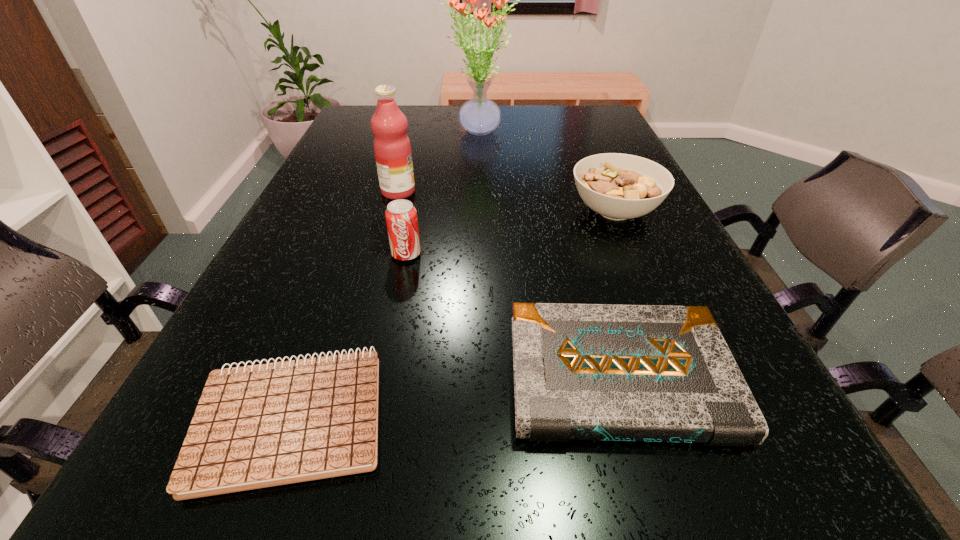
This screenshot has height=540, width=960. Find the location of `vacant area that satisfies the following two spatial constraints: 1. on the logo side of the third nearest object; 2. on the right side of the right notebook`. vacant area that satisfies the following two spatial constraints: 1. on the logo side of the third nearest object; 2. on the right side of the right notebook is located at coordinates (381, 378).

Identify the location of free location that satisfies the following two spatial constraints: 1. on the back side of the flower arrangement; 2. on the right side of the shortest object. This screenshot has height=540, width=960. [x=394, y=133].

At what (x,y) coordinates should I click in order to perform the action: click on free spot that satisfies the following two spatial constraints: 1. on the logo side of the third nearest object; 2. on the left side of the right notebook. Please return your answer as a coordinate pair (x, y). Looking at the image, I should click on (381, 378).